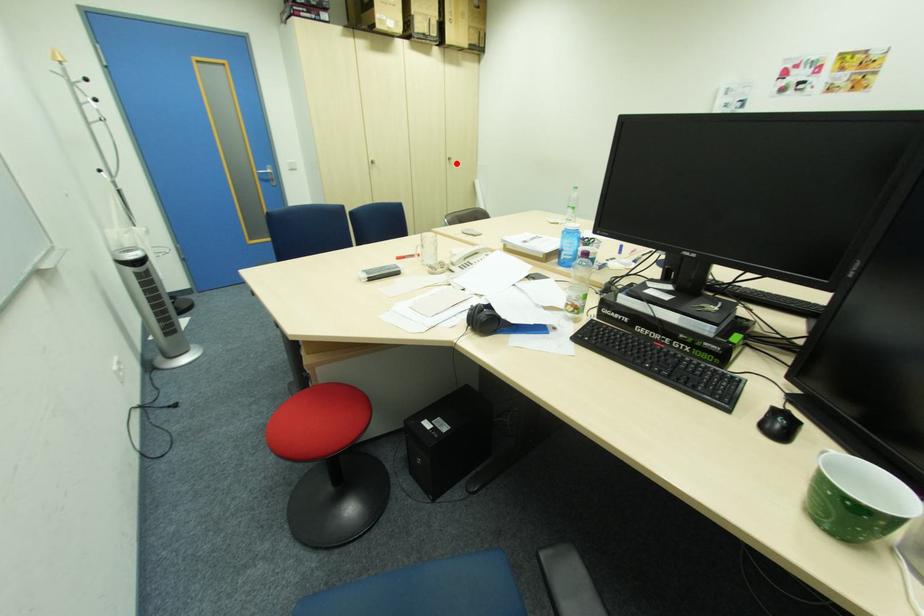
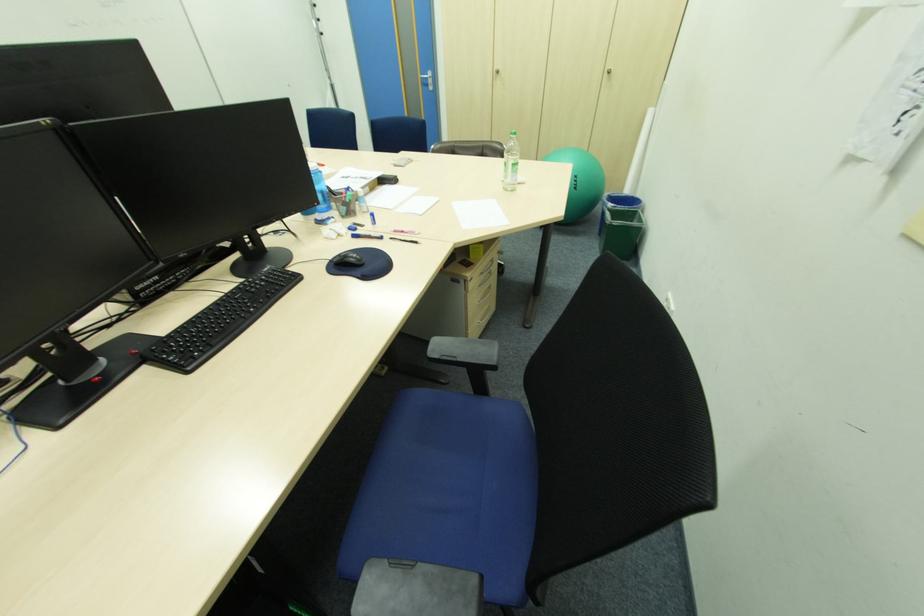
Find the pixel in the second image that matches the highlighted location in the first image.

(615, 79)